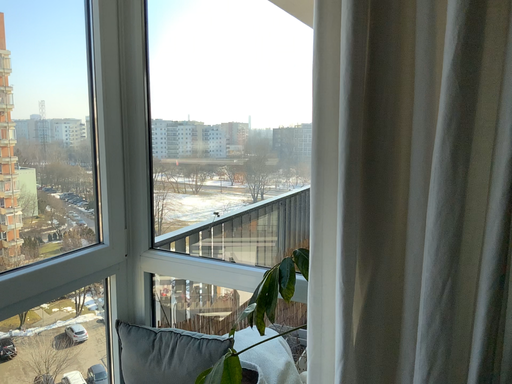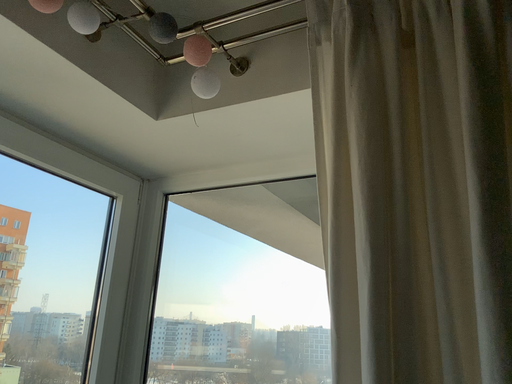
Question: Which way did the camera rotate in the video?

Choices:
 (A) rotated upward
 (B) rotated downward

Answer: (A)